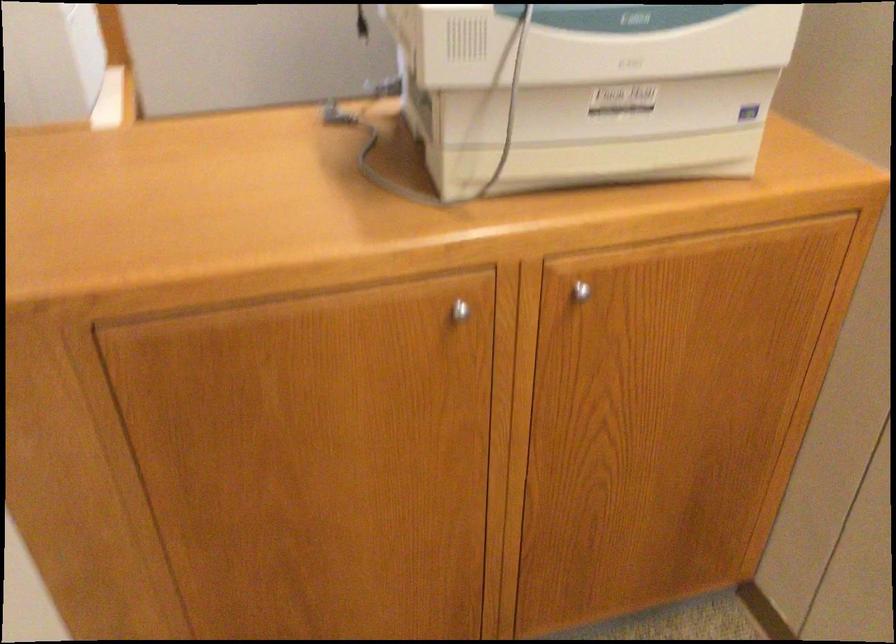
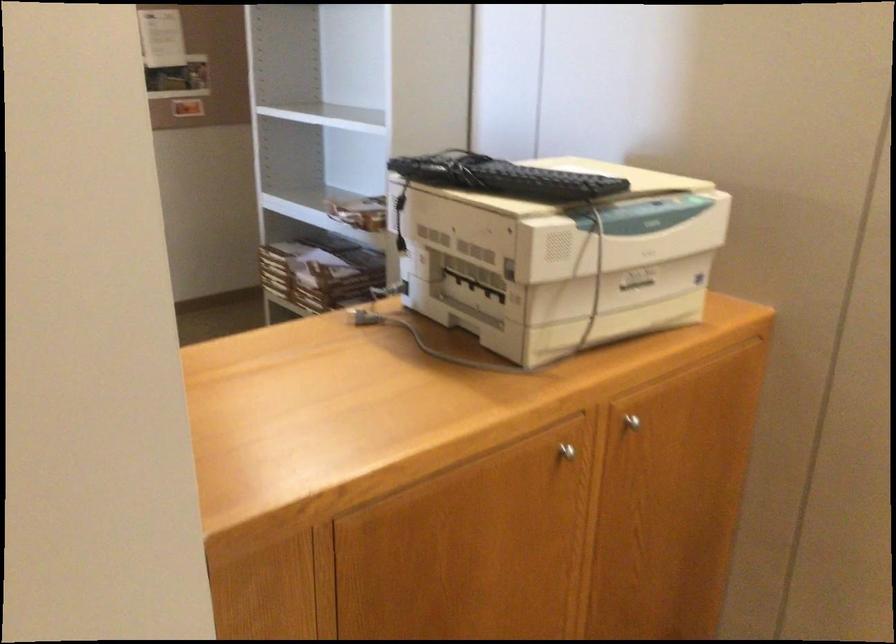
The first image is from the beginning of the video and the second image is from the end. How did the camera likely rotate when shooting the video?

The rotation direction of the camera is right-down.